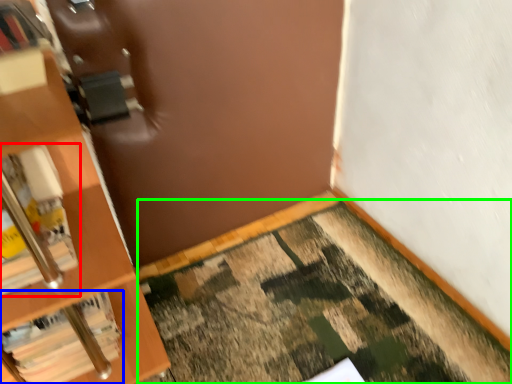
Question: Which object is positioned closest to book (highlighted by a red box)? Select from book (highlighted by a blue box) and doormat (highlighted by a green box).

Choices:
 (A) book
 (B) doormat

Answer: (A)